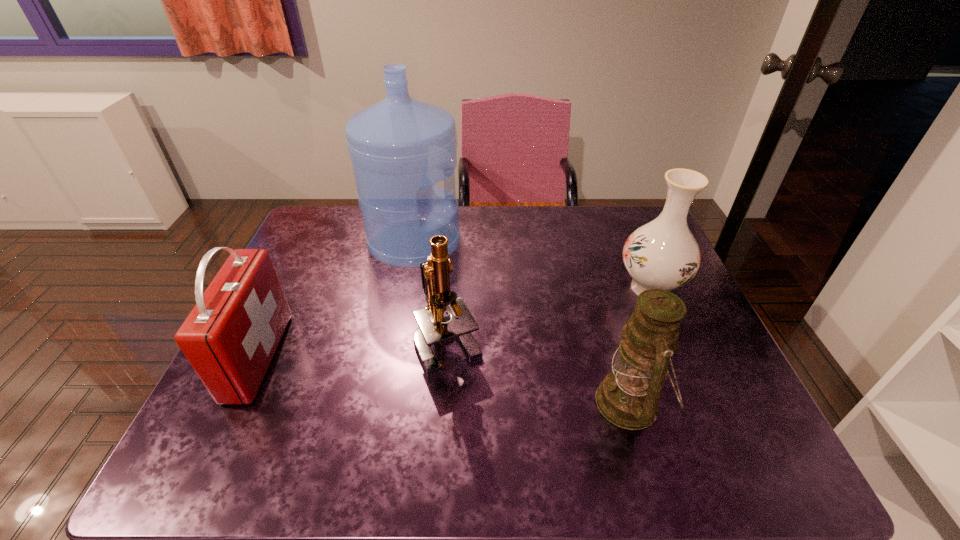
Locate an element on the screen. This screenshot has height=540, width=960. object that is at the far edge is located at coordinates (400, 147).

Where is `object that is positioned at the near edge`? object that is positioned at the near edge is located at coordinates (628, 397).

The width and height of the screenshot is (960, 540). Identify the location of object located in the left edge section of the desktop. (230, 337).

The width and height of the screenshot is (960, 540). I want to click on object present at the right edge, so click(x=663, y=254).

The image size is (960, 540). What are the coordinates of `vacant space at the far edge of the desktop` in the screenshot? It's located at (535, 208).

At what (x,y) coordinates should I click in order to perform the action: click on free region at the near edge of the desktop. Please return your answer as a coordinate pair (x, y). This screenshot has height=540, width=960. Looking at the image, I should click on (455, 451).

In order to click on vacant space at the left edge of the desktop in this screenshot , I will do pos(272,417).

I want to click on vacant space at the right edge of the desktop, so click(x=684, y=424).

Locate an element on the screen. blank space at the far right corner of the desktop is located at coordinates (637, 216).

You are a GUI agent. You are given a task and a screenshot of the screen. Output one action in this format:
    pyautogui.click(x=<x>, y=<y>)
    Task: Click on the vacant region at the near right corner of the desktop
    
    Given the screenshot: What is the action you would take?
    pyautogui.click(x=783, y=471)